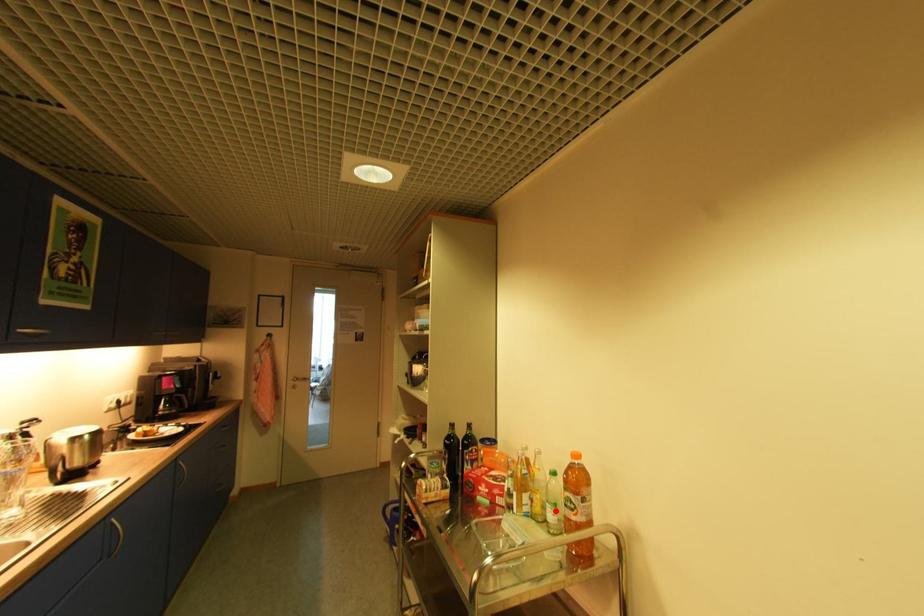
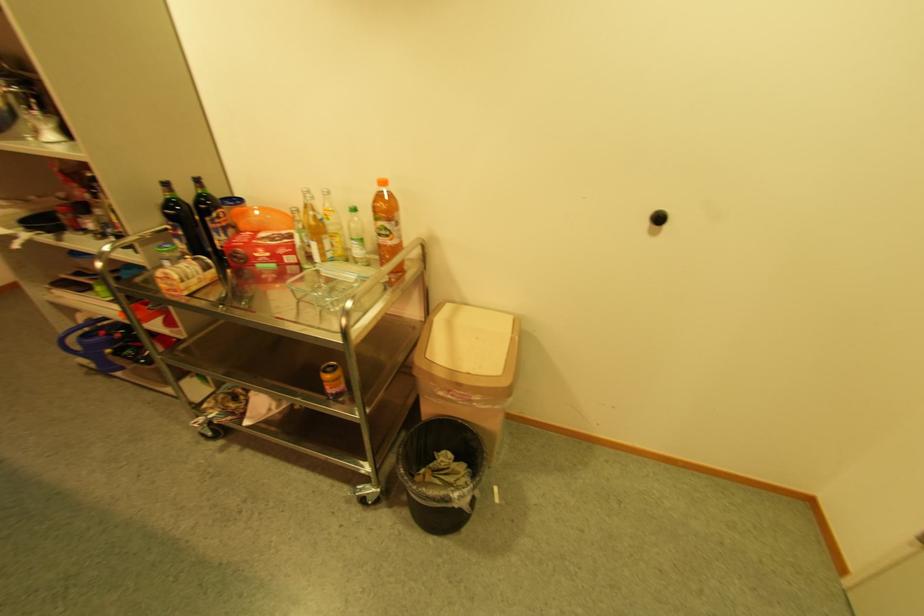
Find the pixel in the second image that matches the highlighted location in the first image.

(363, 246)